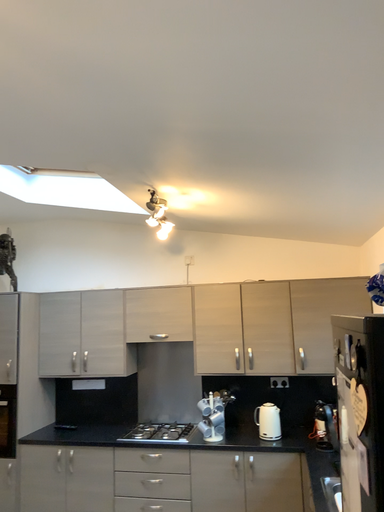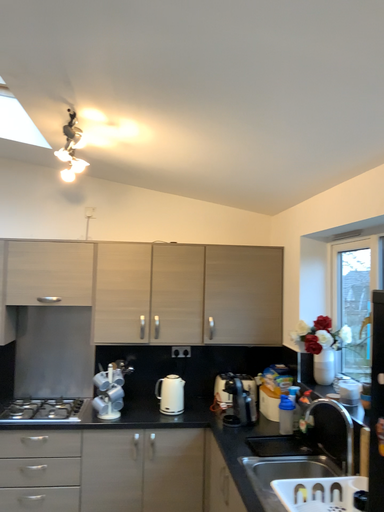
Question: Which way did the camera rotate in the video?

Choices:
 (A) rotated right
 (B) rotated left

Answer: (A)